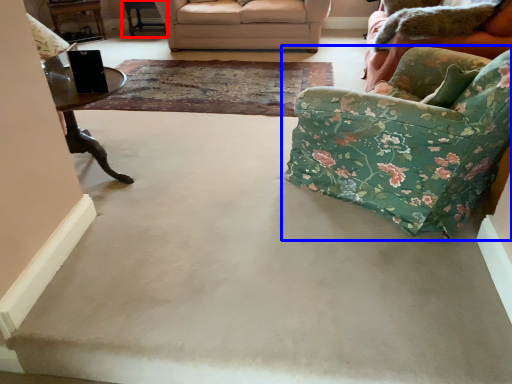
Question: Among these objects, which one is farthest to the camera, table (highlighted by a red box) or chair (highlighted by a blue box)?

Choices:
 (A) table
 (B) chair

Answer: (A)